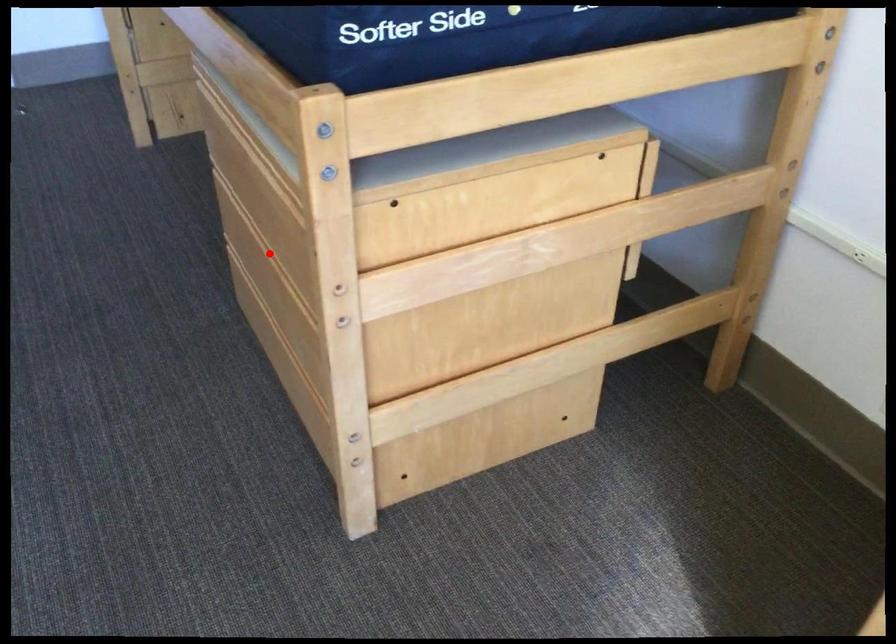
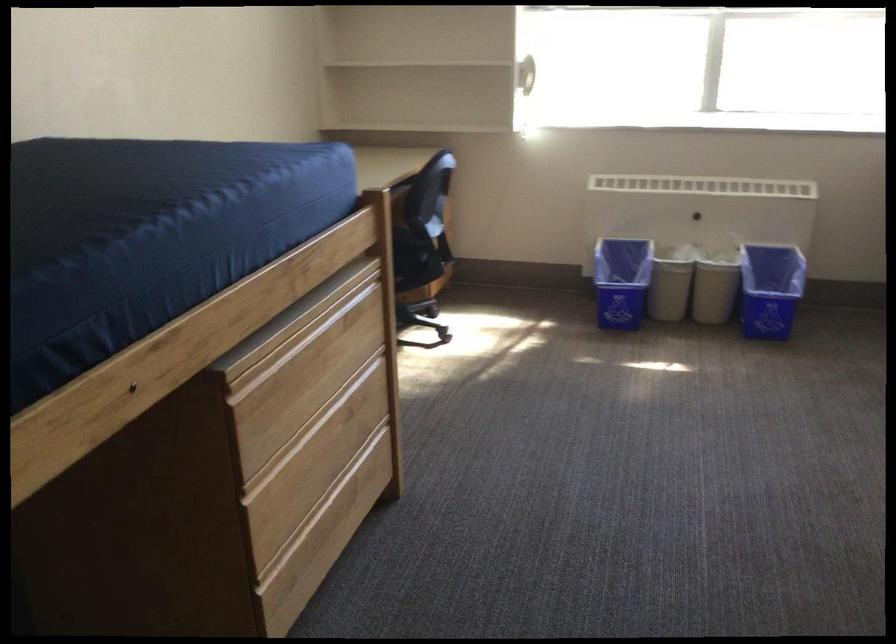
Find the pixel in the second image that matches the highlighted location in the first image.

(307, 431)